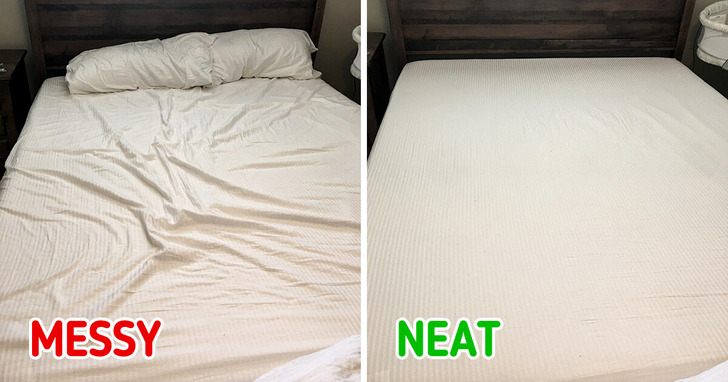
Where is `wooden slats`? This screenshot has height=382, width=728. wooden slats is located at coordinates (456, 35), (71, 41), (81, 15), (459, 9).